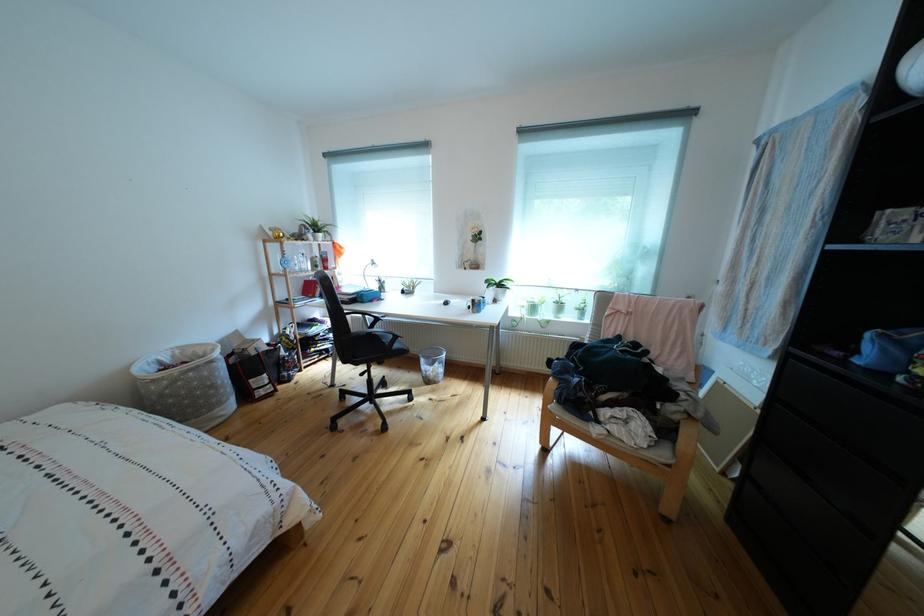
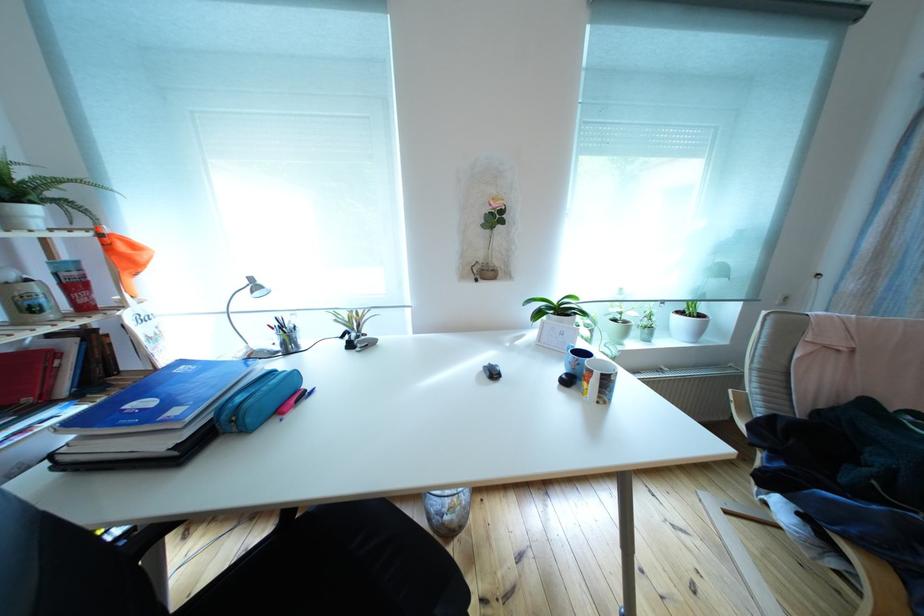
The images are taken continuously from a first-person perspective. In which direction are you moving?

The cameraman walked toward left, forward.